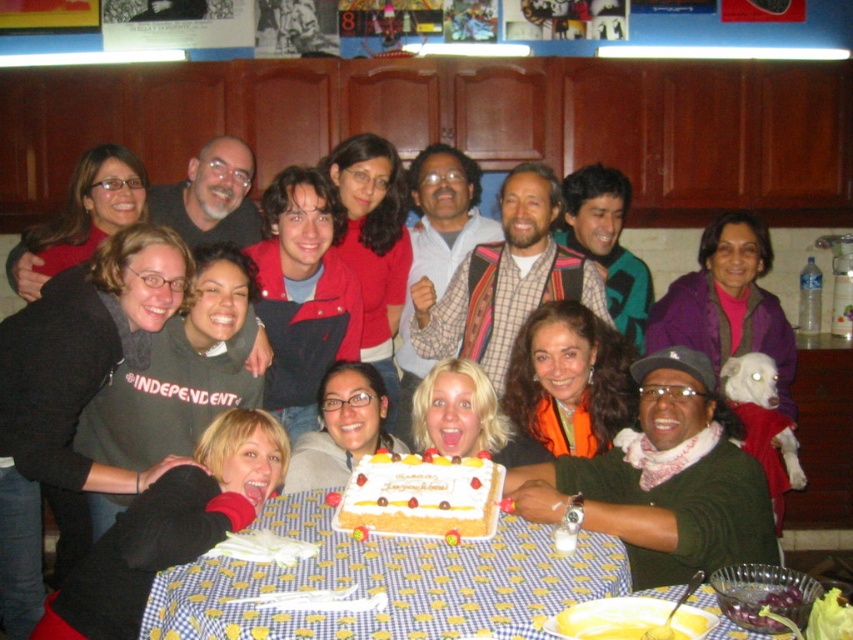
Question: Which point is farther from the camera taking this photo?

Choices:
 (A) (173, 604)
 (B) (434, 454)

Answer: (B)

Question: Does yellow checkered tablecloth at lower center appear on the left side of white frosted cake at center?

Choices:
 (A) yes
 (B) no

Answer: (A)

Question: Which point is farther to the camera?

Choices:
 (A) yellow checkered tablecloth at lower center
 (B) white frosted cake at center

Answer: (B)

Question: Is yellow checkered tablecloth at lower center to the right of white frosted cake at center from the viewer's perspective?

Choices:
 (A) no
 (B) yes

Answer: (A)

Question: Does yellow checkered tablecloth at lower center appear on the left side of white frosted cake at center?

Choices:
 (A) yes
 (B) no

Answer: (A)